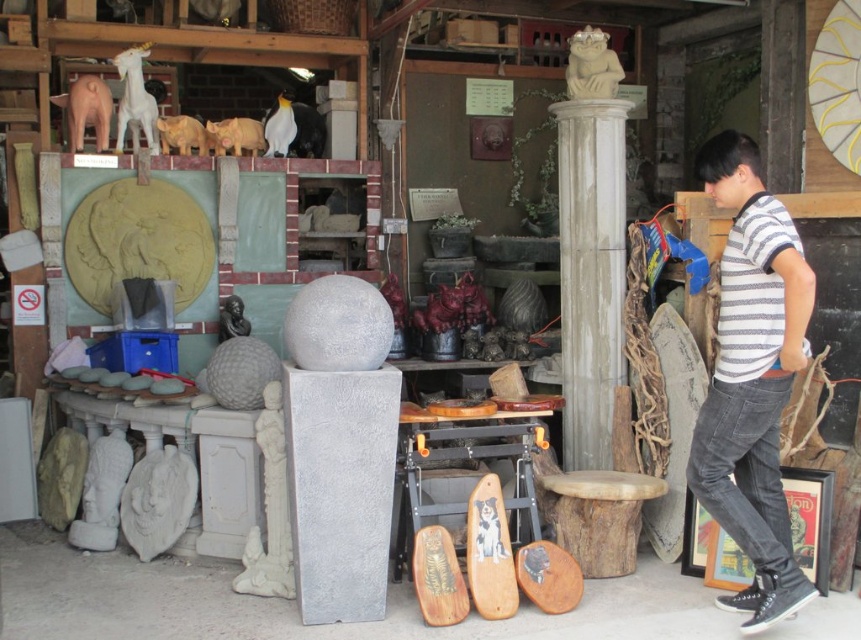
You are standing in front of the market stall and want to determine the relative positions of two points marked in the scene. Which point is closer to you, point (127, 500) or point (234, 152)?

Point (127, 500) is closer to the viewer than point (234, 152).

In the scene shown: You are standing at the point labeled point [79,100] in a cluttered outdoor market stall. You want to take a photo of the entire scene. If the camera you are using has a focal length of 50mm, what is the approximate distance in meters between you and the camera to ensure the entire scene is captured?

The point labeled point [79,100] is 5.27 meters away from the camera. To capture the entire scene with a 50mm lens, you should position yourself approximately 5.27 meters away from the camera.

You are standing at the entrance of the market stall and see the point marked at coordinates [85,109]. Which object is this point located on?

The point marked at coordinates [85,109] is located on the matte pink pig at upper left.